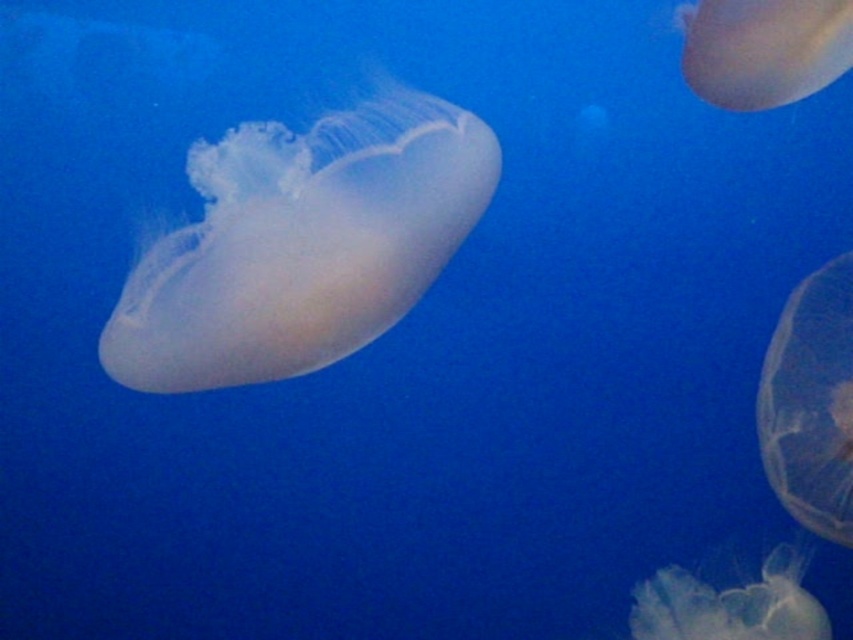
You are a marine biologist observing the underwater scene. You notice two gelatinous creatures, the transparent gelatinous at right and the translucent gelatinous at upper right. Which one is located lower in the water?

The transparent gelatinous at right is positioned under the translucent gelatinous at upper right, so it is located lower in the water.

You are a marine biologist observing the underwater scene. There are two points marked in the image, point 1 at coordinates point (x=695, y=90) and point 2 at coordinates point (x=764, y=605). Which point is closer to your observation position?

Point 1 at coordinates point (x=695, y=90) is closer to your observation position because it is further to the camera than point 2 at coordinates point (x=764, y=605).